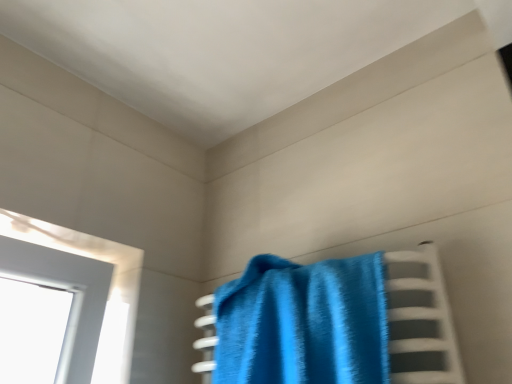
This screenshot has width=512, height=384. What do you see at coordinates (303, 323) in the screenshot? I see `blue fabric towel at center` at bounding box center [303, 323].

Find the location of a particular element. blue fabric towel at center is located at coordinates (303, 323).

Where is `blue fabric towel at center`? blue fabric towel at center is located at coordinates (303, 323).